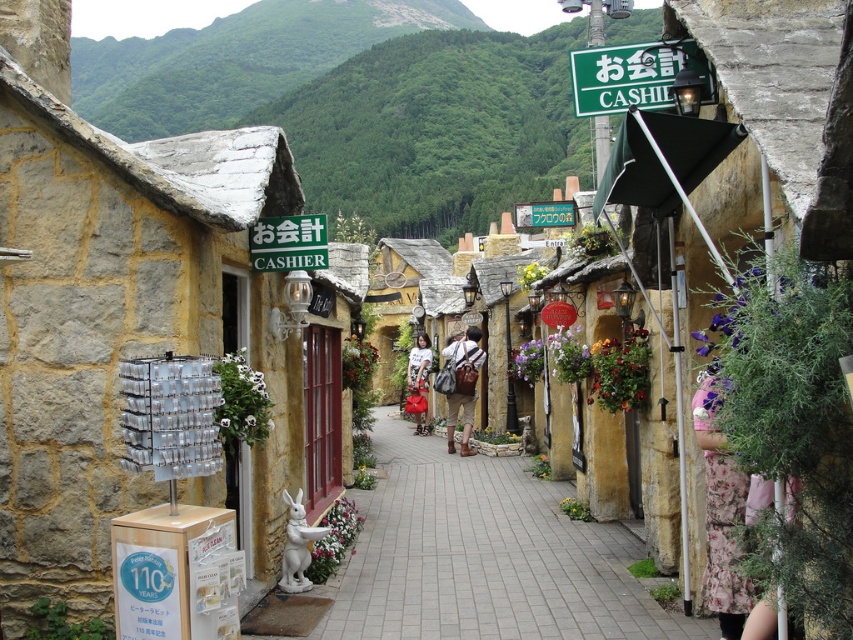
Who is positioned more to the left, green plastic sign at center or matte brown backpack at center?

Positioned to the left is green plastic sign at center.

Find the location of a particular element. Image resolution: width=853 pixels, height=640 pixels. green plastic sign at center is located at coordinates (288, 243).

Which is above, green plastic sign at center or matte white shirt at center?

green plastic sign at center is above.

Between point (288, 240) and point (422, 384), which one is positioned in front?

Positioned in front is point (288, 240).

Who is more forward, (323, 248) or (418, 362)?

Point (323, 248)

At what (x,y) coordinates should I click in order to perform the action: click on green plastic sign at center. Please return your answer as a coordinate pair (x, y). Looking at the image, I should click on (288, 243).

Does paved stone path at center have a lesser width compared to matte white shirt at center?

Incorrect, paved stone path at center's width is not less than matte white shirt at center's.

Can you confirm if paved stone path at center is shorter than matte white shirt at center?

Correct, paved stone path at center is not as tall as matte white shirt at center.

Find the location of `paved stone path at center`. paved stone path at center is located at coordinates (485, 556).

Where is `paved stone path at center`? paved stone path at center is located at coordinates (485, 556).